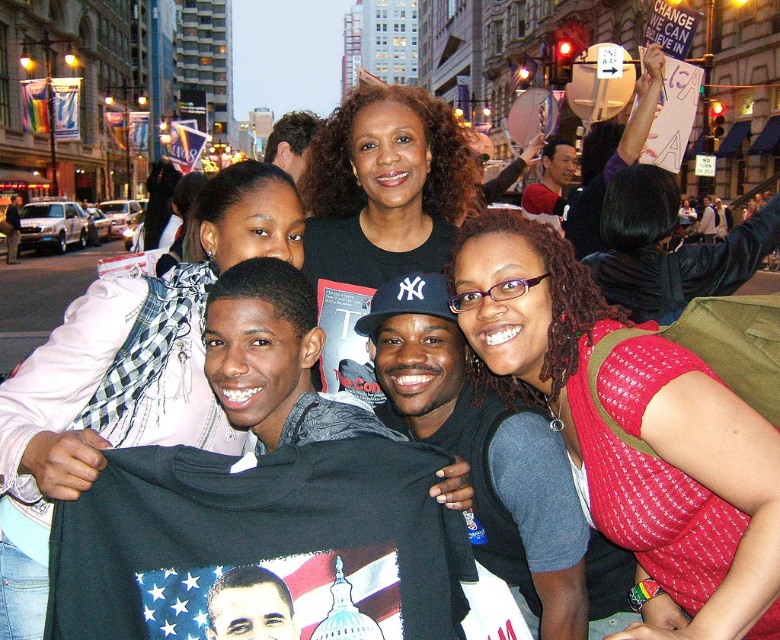
Who is higher up, red quilted vest at center or white scarf at upper left?

Positioned higher is white scarf at upper left.

Is red quilted vest at center wider than white scarf at upper left?

Yes, red quilted vest at center is wider than white scarf at upper left.

In order to click on red quilted vest at center in this screenshot , I will do `click(633, 429)`.

Can you confirm if red quilted vest at center is shorter than black matte t-shirt at center?

Yes, red quilted vest at center is shorter than black matte t-shirt at center.

Which of these two, red quilted vest at center or black matte t-shirt at center, stands taller?

black matte t-shirt at center

Does point (649, 342) come farther from viewer compared to point (380, 152)?

No, it is in front of (380, 152).

Where is `red quilted vest at center`? The height and width of the screenshot is (640, 780). red quilted vest at center is located at coordinates (633, 429).

This screenshot has height=640, width=780. Identify the location of white scarf at upper left. (126, 376).

Is point (151, 276) closer to viewer compared to point (387, 109)?

Yes.

Between point (9, 440) and point (380, 148), which one is positioned in front?

Point (9, 440) is more forward.

Locate an element on the screen. This screenshot has height=640, width=780. white scarf at upper left is located at coordinates (126, 376).